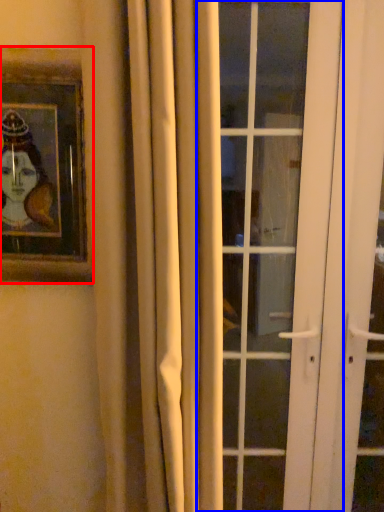
Question: Which point is further to the camera, picture frame (highlighted by a red box) or door (highlighted by a blue box)?

Choices:
 (A) picture frame
 (B) door

Answer: (B)